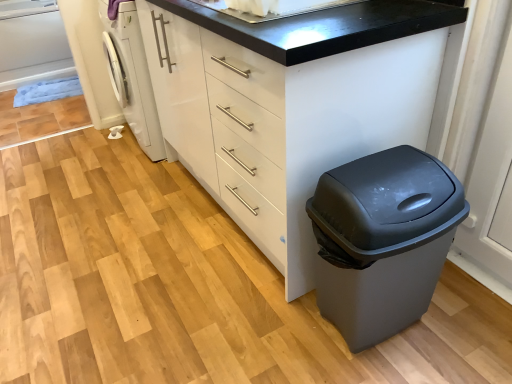
Question: From the image's perspective, is white glossy sink at upper center positioned above or below white glossy washing machine at left?

Choices:
 (A) above
 (B) below

Answer: (B)

Question: From a real-world perspective, is white glossy sink at upper center above or below white glossy washing machine at left?

Choices:
 (A) above
 (B) below

Answer: (A)

Question: Based on their relative distances, which object is farther from the white glossy sink at upper center?

Choices:
 (A) white matte chest of drawers at center
 (B) matte gray plastic trash can at lower right
 (C) white glossy washing machine at left

Answer: (C)

Question: Which object is positioned farthest from the matte gray plastic trash can at lower right?

Choices:
 (A) white glossy sink at upper center
 (B) white matte chest of drawers at center
 (C) white glossy washing machine at left

Answer: (C)